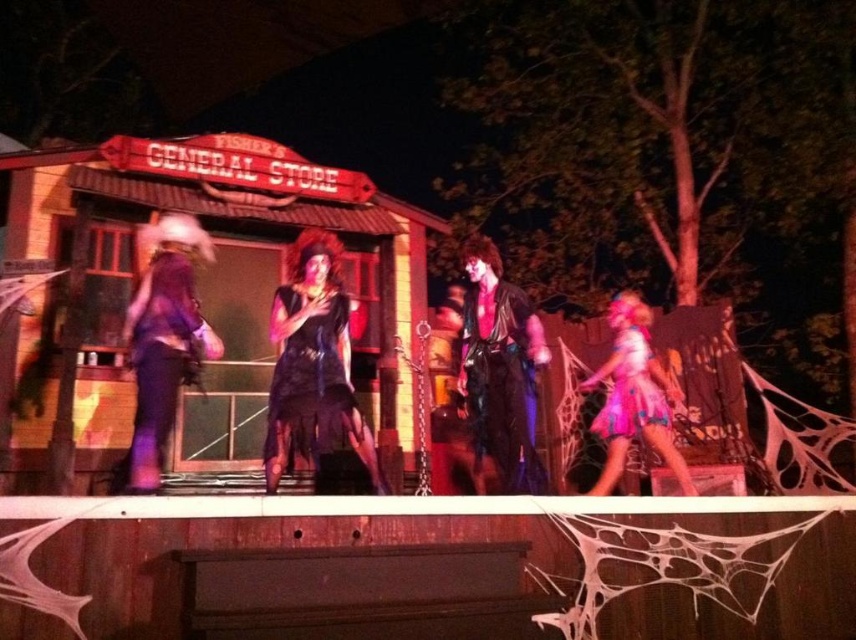
Can you confirm if black velvet dress at center is wider than pink satin dress at lower right?

In fact, black velvet dress at center might be narrower than pink satin dress at lower right.

Which is in front, point (318, 400) or point (658, 413)?

Point (318, 400) is more forward.

Locate an element on the screen. black velvet dress at center is located at coordinates (313, 364).

Between purple velvet dress at left and pink satin dress at lower right, which one appears on the right side from the viewer's perspective?

Positioned to the right is pink satin dress at lower right.

Does point (128, 348) come behind point (652, 413)?

Yes, it is.

Who is more distant from viewer, (x=180, y=228) or (x=632, y=337)?

The point (x=632, y=337) is behind.

Locate an element on the screen. purple velvet dress at left is located at coordinates (163, 342).

Which is more to the left, leather-like black dress at center or pink satin dress at lower right?

From the viewer's perspective, leather-like black dress at center appears more on the left side.

The image size is (856, 640). Describe the element at coordinates (500, 372) in the screenshot. I see `leather-like black dress at center` at that location.

Is point (502, 444) more distant than point (617, 307)?

That is False.

The image size is (856, 640). What are the coordinates of `leather-like black dress at center` in the screenshot? It's located at (500, 372).